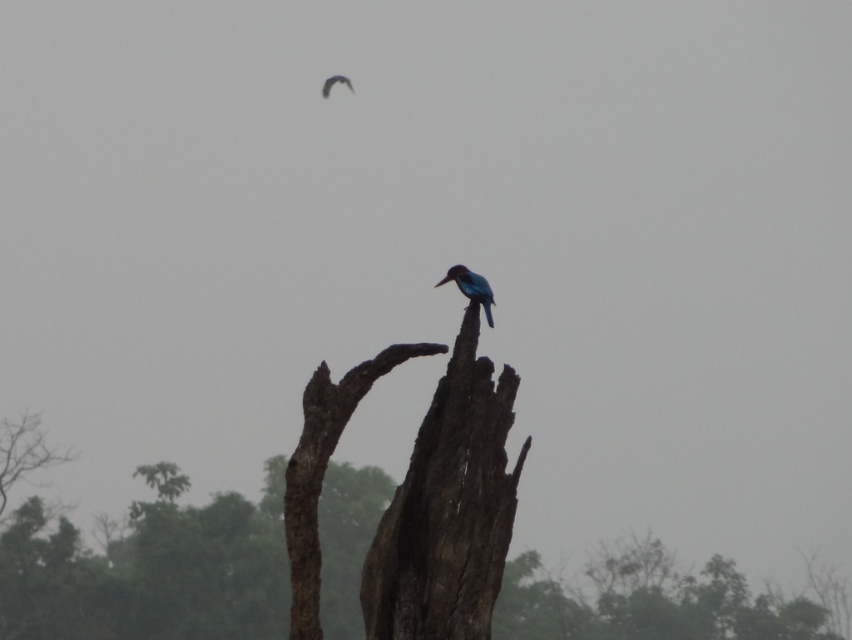
Between smooth brown wood at center and shiny blue bird at upper center, which one has less height?

smooth brown wood at center is shorter.

Can you confirm if smooth brown wood at center is positioned to the left of shiny blue bird at upper center?

No, smooth brown wood at center is not to the left of shiny blue bird at upper center.

What are the coordinates of `smooth brown wood at center` in the screenshot? It's located at (448, 508).

The image size is (852, 640). What are the coordinates of `smooth brown wood at center` in the screenshot? It's located at (448, 508).

Find the location of `smooth brown wood at center`. smooth brown wood at center is located at coordinates (448, 508).

Can you confirm if blue glossy bird at center is positioned below shiny blue bird at upper center?

→ Indeed, blue glossy bird at center is positioned under shiny blue bird at upper center.

This screenshot has height=640, width=852. Describe the element at coordinates (471, 288) in the screenshot. I see `blue glossy bird at center` at that location.

Locate an element on the screen. Image resolution: width=852 pixels, height=640 pixels. blue glossy bird at center is located at coordinates (471, 288).